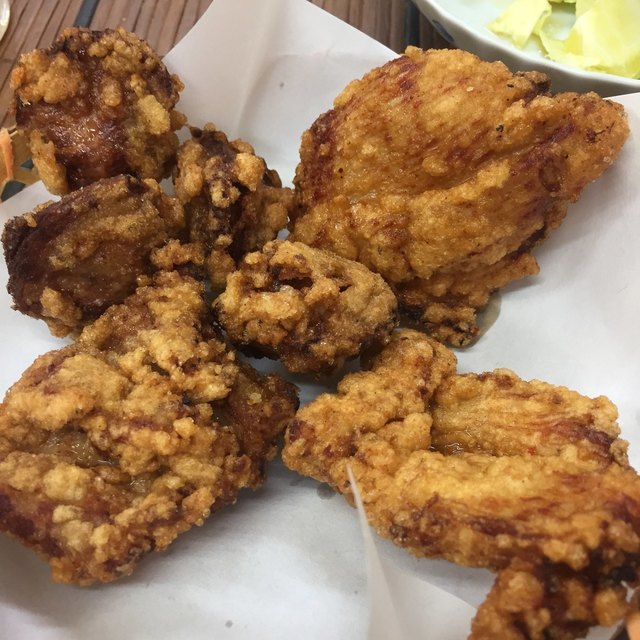
I want to click on table, so click(x=141, y=10).